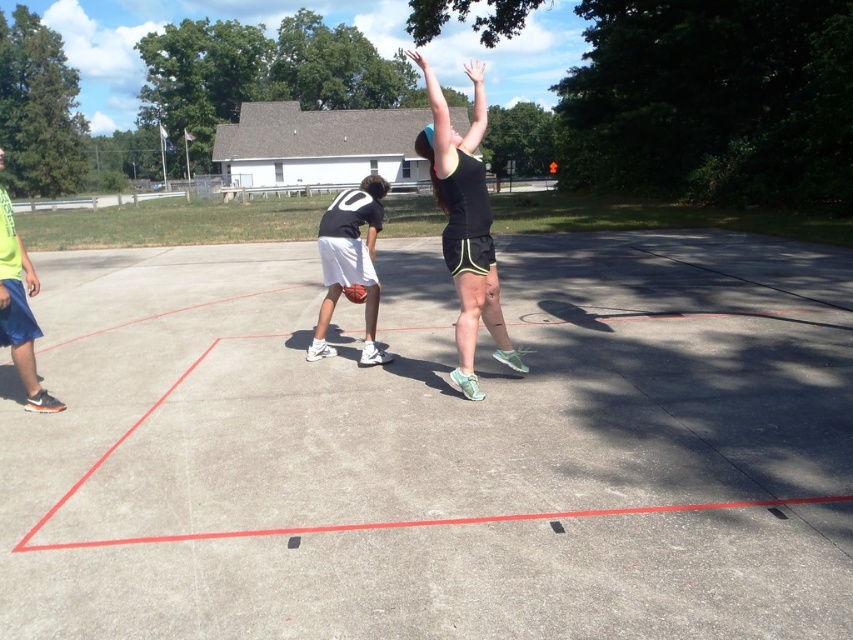
You are a photographer trying to capture a closeup shot of the basketball without including the shorts. Given that the black matte shorts at center and glossy orange basketball at center are both at the center, can you determine if the basketball is narrower than the shorts?

The black matte shorts at center might be wider than glossy orange basketball at center, so there is a possibility that the basketball is narrower. To ensure the basketball fits within the frame without the shorts, you should check the width difference and adjust your angle or zoom accordingly.

You are a photographer standing at the edge of the basketball court and want to take a photo of the concrete at center and the black matte shorts at center. Which object will appear larger in your photo?

The concrete at center will appear larger in the photo because it is closer to the viewer than the black matte shorts at center.